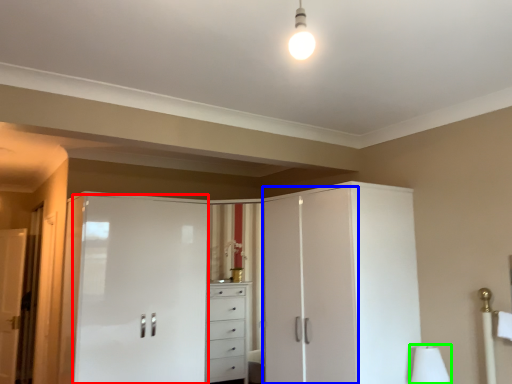
Question: Based on their relative distances, which object is nearer to screen door (highlighted by a red box)? Choose from screen door (highlighted by a blue box) and table lamp (highlighted by a green box).

Choices:
 (A) screen door
 (B) table lamp

Answer: (A)